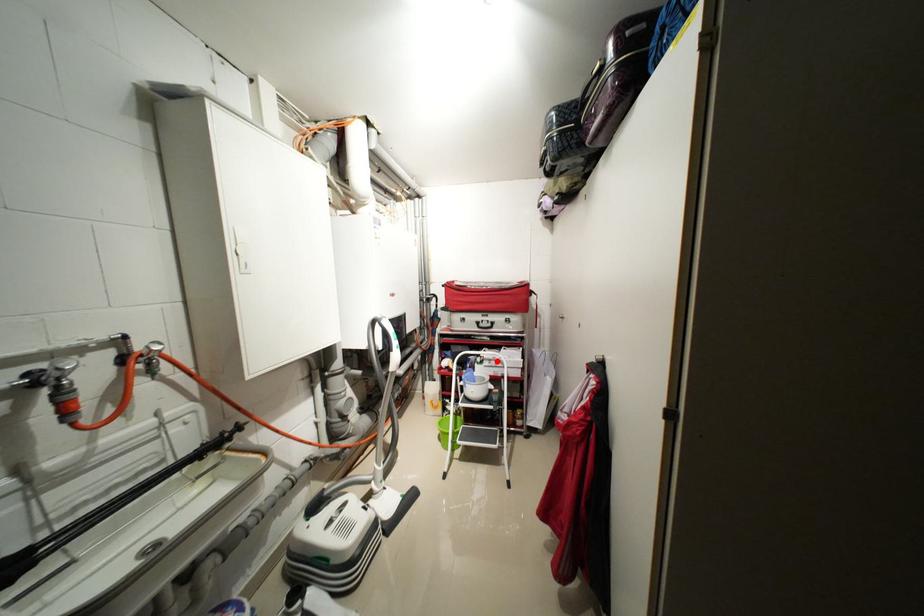
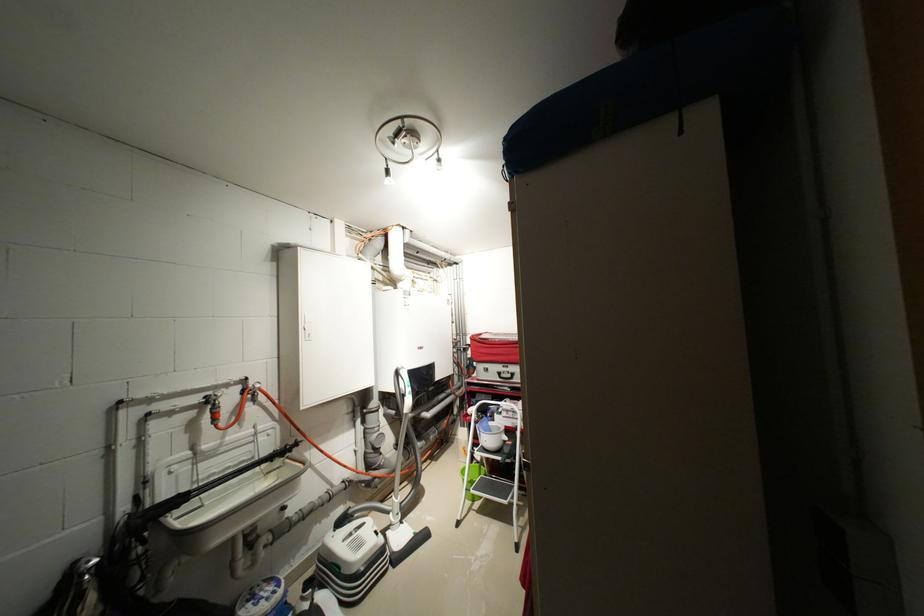
Question: I am providing you with two images of the same scene from different viewpoints. A red point is shown in image1. For the corresponding object point in image2, is it positioned nearer or farther from the camera?

Choices:
 (A) Nearer
 (B) Farther

Answer: (B)